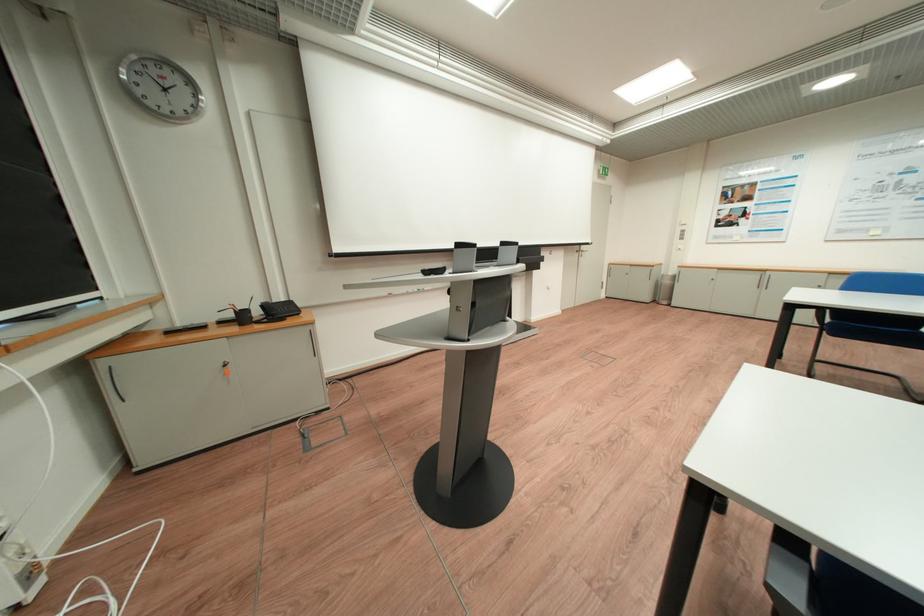
Find where to lift the black phone handset. Please return your answer as a coordinate pair (x, y).

(275, 310)